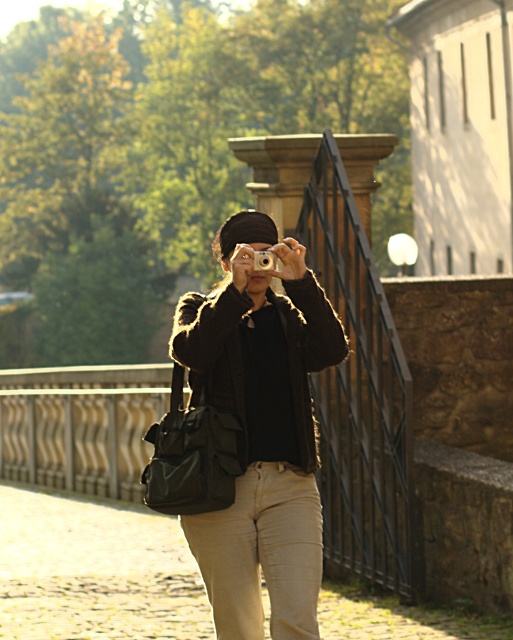
From the picture: You are a photographer trying to decide whether to take a photo of the matte black camera at center and the khaki cotton pants at center. Based on their sizes in the image, which one would appear larger in the final photo?

The matte black camera at center is much taller than the khaki cotton pants at center, so it would appear larger in the photo.

You are a photographer who wants to ensure your khaki cotton pants at center and silver metallic camera at center are visible in the photo. Since the camera is at the same height as the pants, how should you adjust your position to include both in the frame?

The khaki cotton pants at center is taller than the silver metallic camera at center, so to include both in the frame, you should lower your camera angle slightly to capture the full height of the pants while ensuring the camera is still visible.

You are a photographer trying to decide which camera to use. You see a matte black camera at center and a silver metallic camera at center. Which one is positioned to the left?

The matte black camera at center is positioned to the left of the silver metallic camera at center.